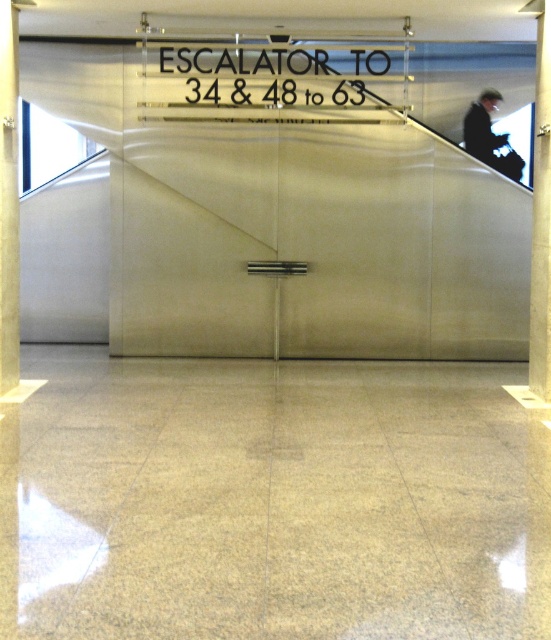
You are standing in the room and want to place a small potted plant between the metallic pillar at right and the dark suit at upper right. Based on their positions, can you determine which object you should place the plant closer to?

The metallic pillar at right is below the dark suit at upper right, so you should place the plant closer to the metallic pillar at right since it is lower in position.